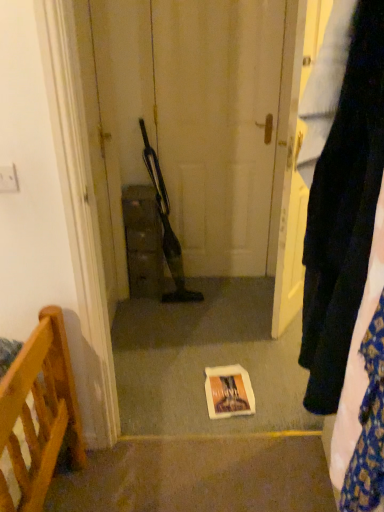
You are a GUI agent. You are given a task and a screenshot of the screen. Output one action in this format:
    pyautogui.click(x=<x>, y=<y>)
    Task: Click on the vacant space situated above white paper bag at center (from a real-world perspective)
    Image resolution: width=384 pixels, height=512 pixels.
    Given the screenshot: What is the action you would take?
    pyautogui.click(x=218, y=385)